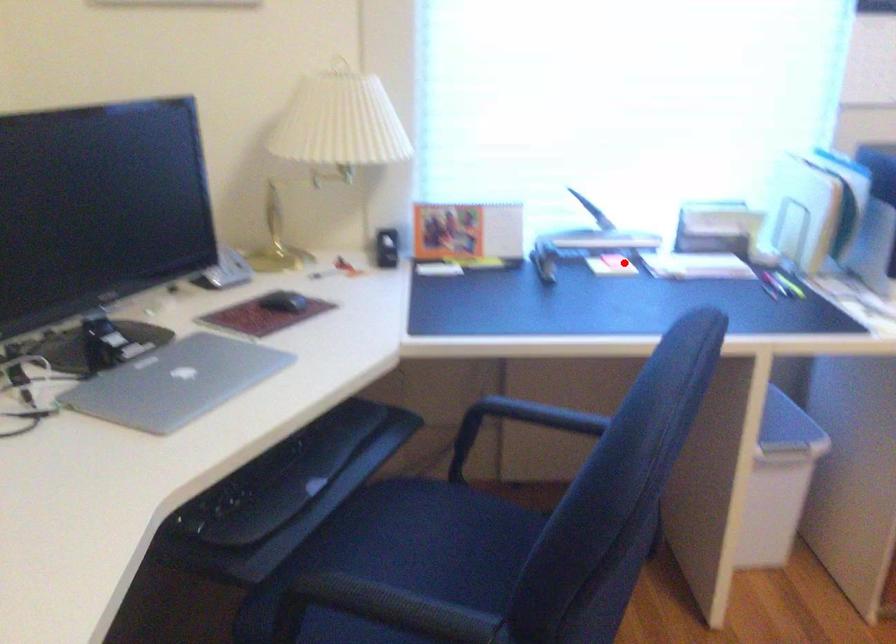
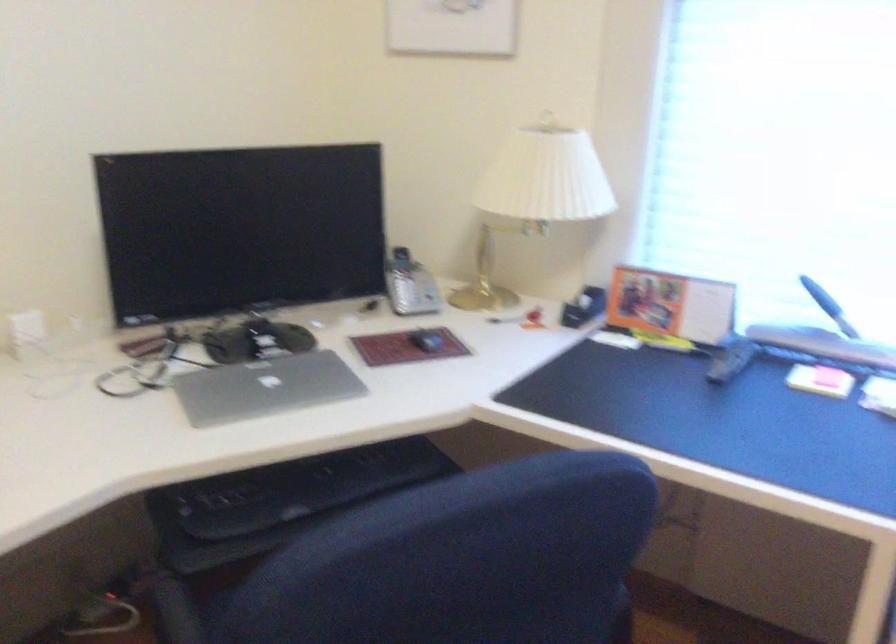
Question: I am providing you with two images of the same scene from different viewpoints. In image1, a red point is highlighted. Considering the same 3D point in image2, which of the following is correct?

Choices:
 (A) It is closer
 (B) It is farther

Answer: (A)